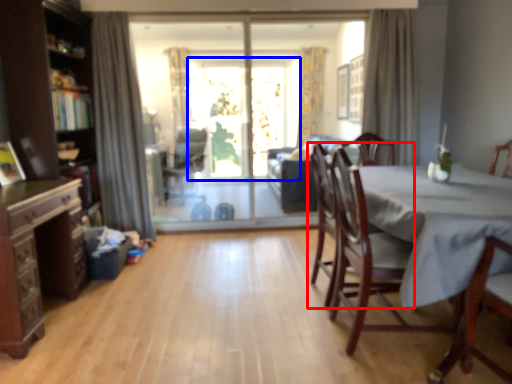
Question: Which point is further to the camera, chair (highlighted by a red box) or window screen (highlighted by a blue box)?

Choices:
 (A) chair
 (B) window screen

Answer: (B)